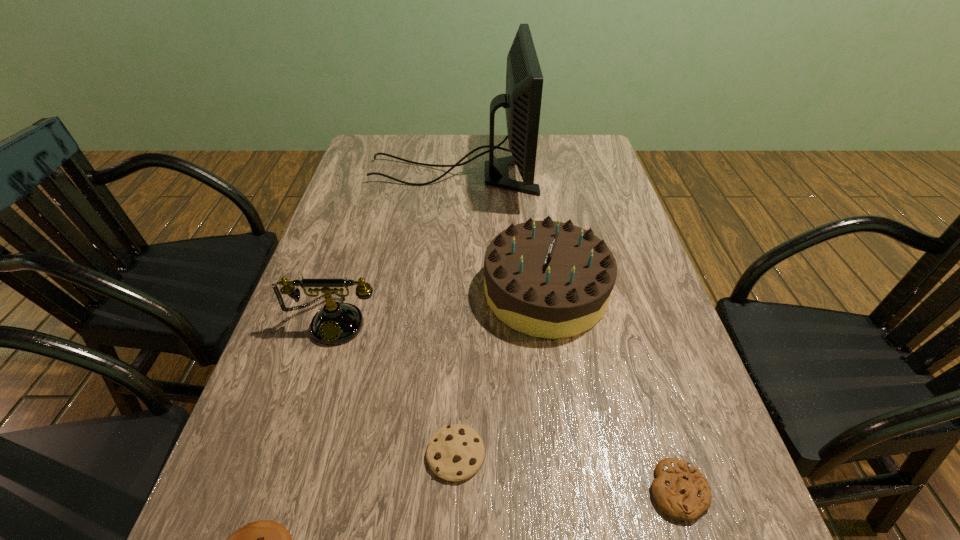
Locate an element on the screen. The image size is (960, 540). vacant region that satisfies the following two spatial constraints: 1. on the dial of the third shortest object; 2. on the left side of the telephone is located at coordinates (296, 454).